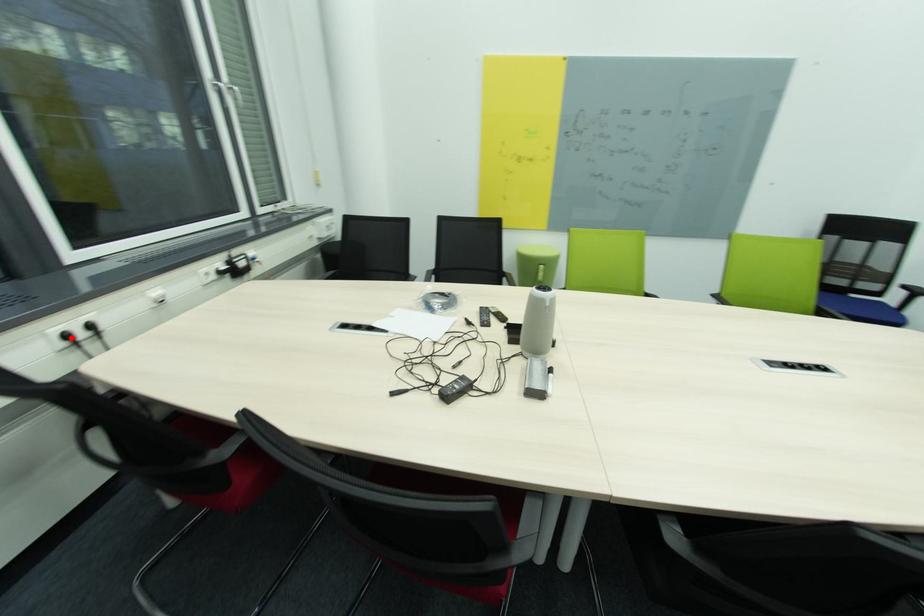
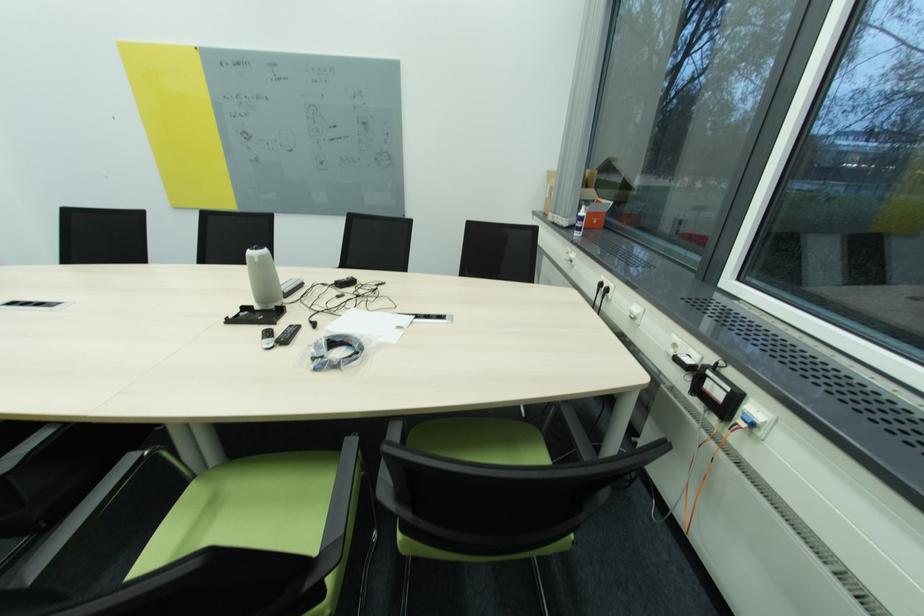
In the second image, find the point that corresponds to the highlighted location in the first image.

(604, 286)